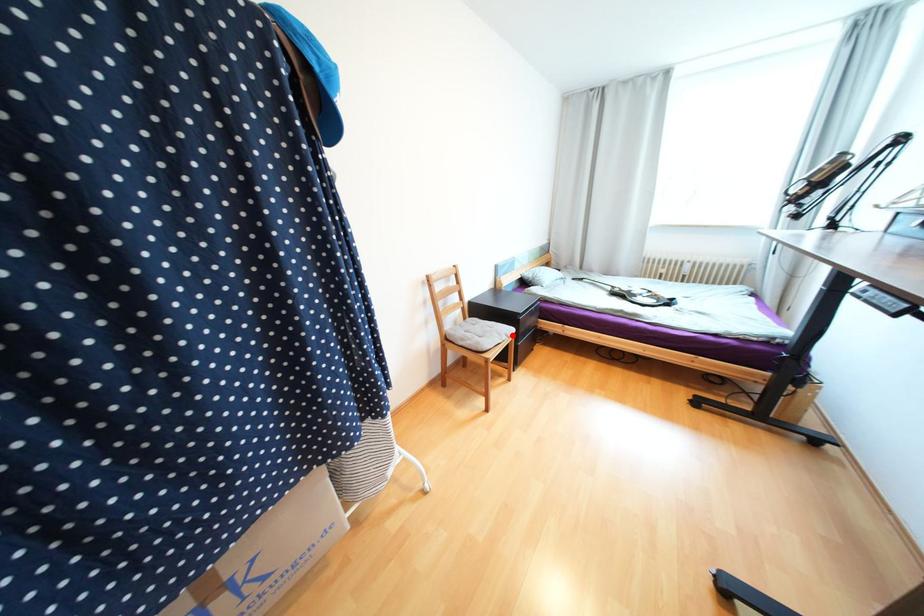
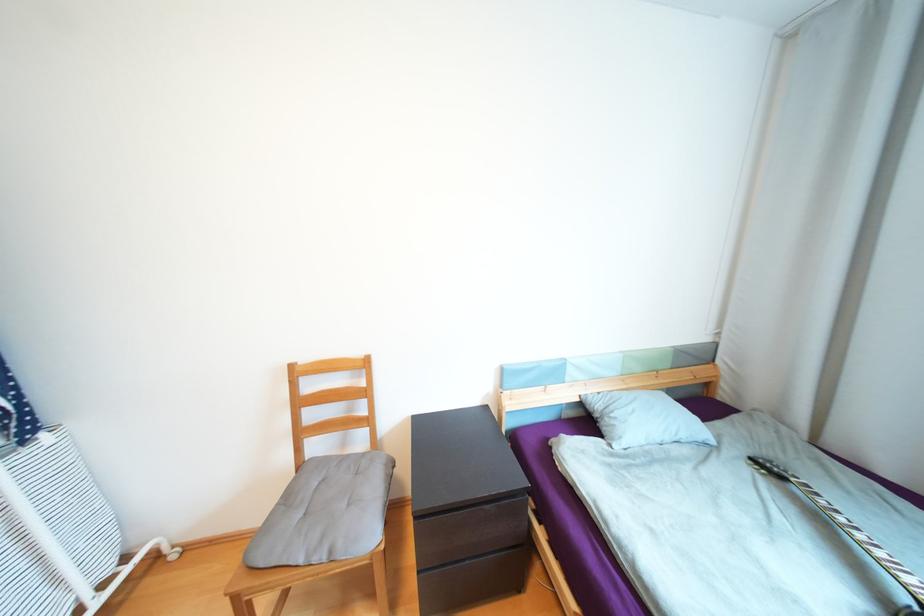
Locate, in the second image, the point that corresponds to the highlighted location in the first image.

(335, 553)